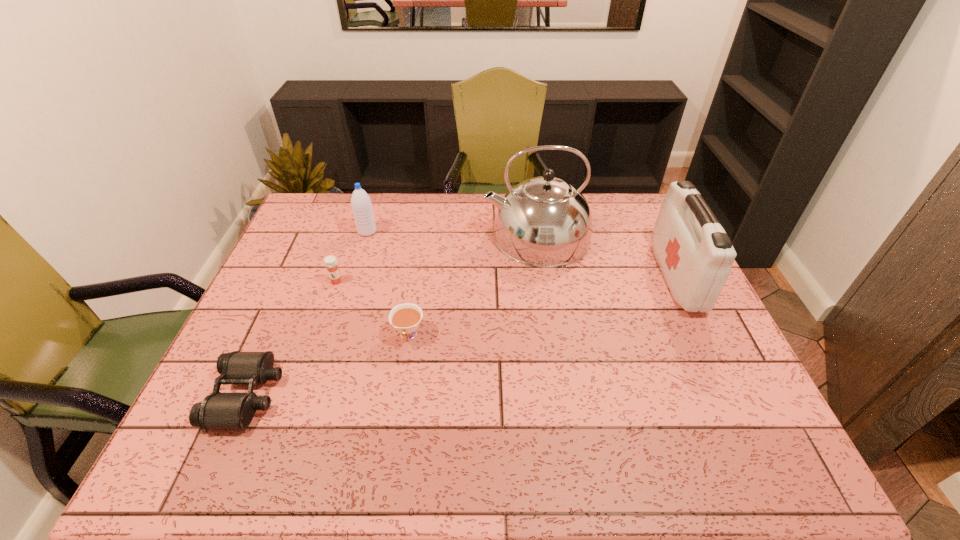
In the image, there is a desktop. Identify the location of vacant area at the far right corner. [637, 197].

At what (x,y) coordinates should I click in order to perform the action: click on free space between the water bottle and the fourth tallest object. Please return your answer as a coordinate pair (x, y). The width and height of the screenshot is (960, 540). Looking at the image, I should click on (352, 256).

You are a GUI agent. You are given a task and a screenshot of the screen. Output one action in this format:
    pyautogui.click(x=<x>, y=<y>)
    Task: Click on the free space between the medicine and the third tallest object
    
    Given the screenshot: What is the action you would take?
    pyautogui.click(x=352, y=256)

Image resolution: width=960 pixels, height=540 pixels. Find the location of `vacant area that lies between the third shortest object and the fifth object from left to right`. vacant area that lies between the third shortest object and the fifth object from left to right is located at coordinates (437, 259).

Where is `free spot between the water bottle and the kettle`? The height and width of the screenshot is (540, 960). free spot between the water bottle and the kettle is located at coordinates tap(452, 234).

Find the location of `free spot between the fifth object from left to right and the medicine`. free spot between the fifth object from left to right and the medicine is located at coordinates (437, 259).

Image resolution: width=960 pixels, height=540 pixels. Identify the location of vacant point located between the water bottle and the tallest object. (452, 234).

At what (x,y) coordinates should I click in order to perform the action: click on free spot between the medicine and the tallest object. Please return your answer as a coordinate pair (x, y). This screenshot has width=960, height=540. Looking at the image, I should click on (437, 259).

Choose which object is the nearest neighbor to the rightmost object. Please provide its 2D coordinates. Your answer should be formatted as a tuple, i.e. [(x, y)], where the tuple contains the x and y coordinates of a point satisfying the conditions above.

[(544, 221)]

Locate an element on the screen. Image resolution: width=960 pixels, height=540 pixels. object that is the second nearest to the third object from right to left is located at coordinates (218, 410).